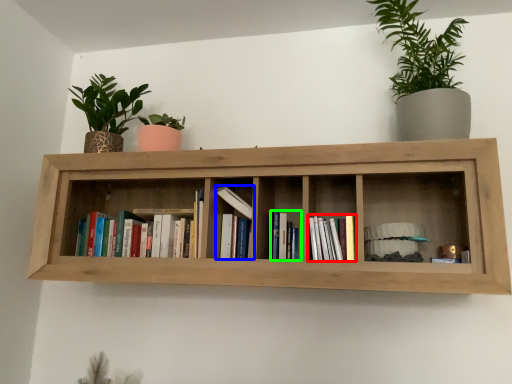
Question: Which object is positioned farthest from book (highlighted by a red box)? Select from book (highlighted by a blue box) and book (highlighted by a green box).

Choices:
 (A) book
 (B) book

Answer: (A)